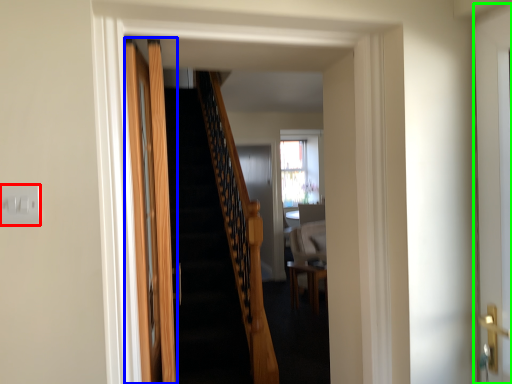
Question: Estimate the real-world distances between objects in this image. Which object is farther from electric outlet (highlighted by a red box), door (highlighted by a blue box) or door (highlighted by a green box)?

Choices:
 (A) door
 (B) door

Answer: (B)